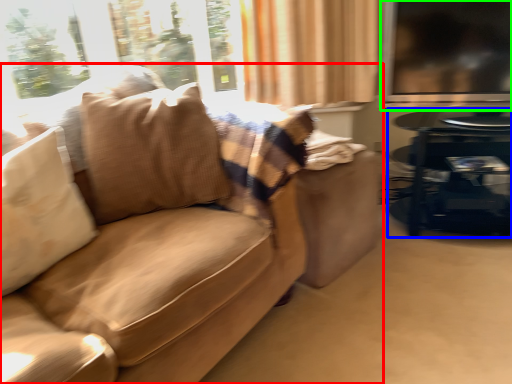
Question: Which object is the closest to the studio couch (highlighted by a red box)? Choose among these: table (highlighted by a blue box) or window screen (highlighted by a green box).

Choices:
 (A) table
 (B) window screen

Answer: (A)